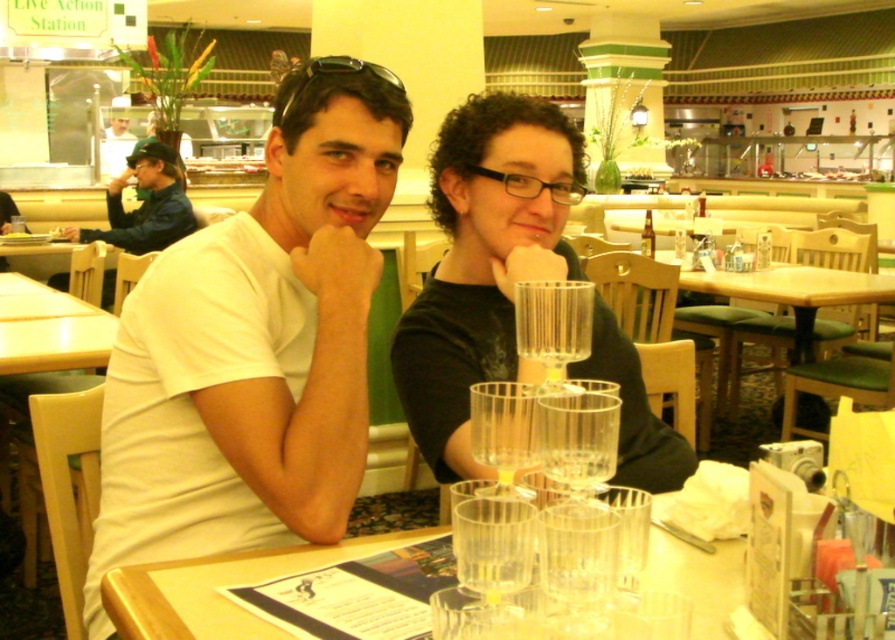
Measure the distance between clear glass cups at center and camera.

clear glass cups at center is 33.30 inches away from camera.

Is clear glass cups at center bigger than clear glass at center?

Yes, clear glass cups at center is bigger than clear glass at center.

Identify the location of clear glass cups at center. (216, 593).

At what (x,y) coordinates should I click in order to perform the action: click on clear glass cups at center. Please return your answer as a coordinate pair (x, y). The width and height of the screenshot is (895, 640). Looking at the image, I should click on (216, 593).

Describe the element at coordinates (483, 262) in the screenshot. The width and height of the screenshot is (895, 640). I see `matte white shirt at center` at that location.

The image size is (895, 640). In order to click on matte white shirt at center in this screenshot , I will do `click(483, 262)`.

Is point (294, 413) positioned behind point (825, 296)?

No, (294, 413) is closer to viewer.

Is white matte t-shirt at center shorter than wooden table at center?

No, white matte t-shirt at center is not shorter than wooden table at center.

The image size is (895, 640). Find the location of `white matte t-shirt at center`. white matte t-shirt at center is located at coordinates (253, 349).

Where is `white matte t-shirt at center`? white matte t-shirt at center is located at coordinates (253, 349).